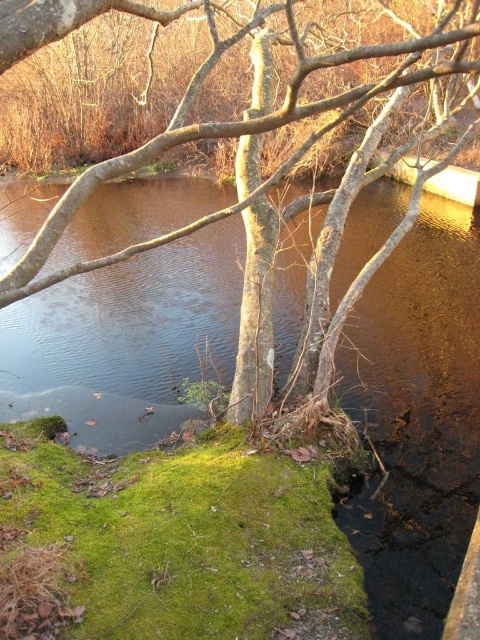
Does brown smooth water at center appear on the right side of brown bark tree at center?

Incorrect, brown smooth water at center is not on the right side of brown bark tree at center.

Who is more distant from viewer, (377, 362) or (256, 61)?

Point (377, 362)

Where is `brown smooth water at center`? The width and height of the screenshot is (480, 640). brown smooth water at center is located at coordinates (418, 417).